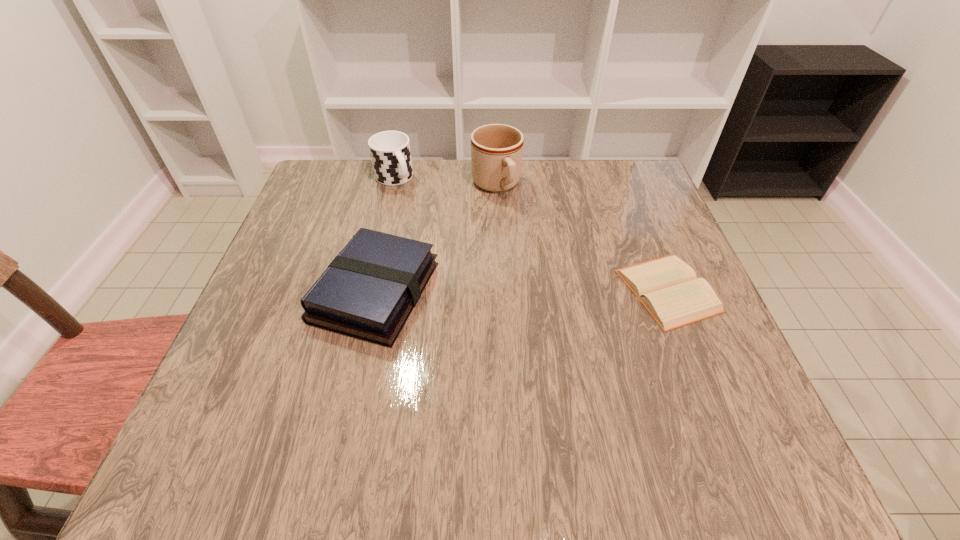
The height and width of the screenshot is (540, 960). What are the coordinates of `unoccupied area between the diary and the mug` in the screenshot? It's located at (582, 238).

Image resolution: width=960 pixels, height=540 pixels. I want to click on free spot between the rightmost object and the second tallest object, so click(531, 234).

You are a GUI agent. You are given a task and a screenshot of the screen. Output one action in this format:
    pyautogui.click(x=<x>, y=<y>)
    Task: Click on the vacant region between the tallest object and the book
    The width and height of the screenshot is (960, 540).
    Given the screenshot: What is the action you would take?
    pyautogui.click(x=436, y=239)

Where is `empty space between the diary and the third shortest object`? The height and width of the screenshot is (540, 960). empty space between the diary and the third shortest object is located at coordinates (531, 234).

At what (x,y) coordinates should I click in order to perform the action: click on object that ranks as the third closest to the mug. Please return your answer as a coordinate pair (x, y). Looking at the image, I should click on (667, 287).

Where is `object that stands as the second closest to the cup`? The height and width of the screenshot is (540, 960). object that stands as the second closest to the cup is located at coordinates (368, 291).

Where is `vacant space that satisfies the following two spatial constraints: 1. on the front side of the third shortest object; 2. on the right side of the book`? The width and height of the screenshot is (960, 540). vacant space that satisfies the following two spatial constraints: 1. on the front side of the third shortest object; 2. on the right side of the book is located at coordinates (366, 292).